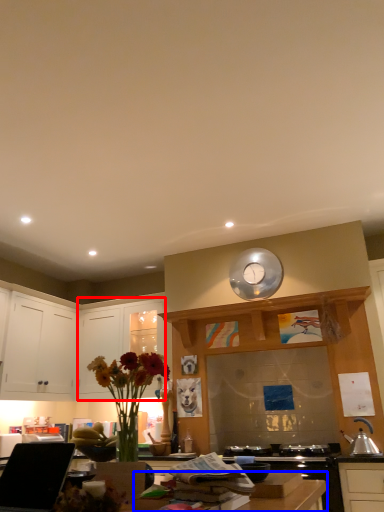
Question: Which of the following is the closest to the observer, cabinetry (highlighted by a red box) or counter top (highlighted by a blue box)?

Choices:
 (A) cabinetry
 (B) counter top

Answer: (B)